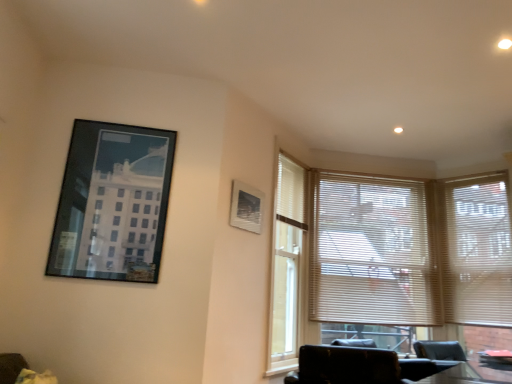
Question: Should I look upward or downward to see white blinds at right, the 1th window blind positioned from the right?

Choices:
 (A) up
 (B) down

Answer: (B)

Question: Can you confirm if matte black picture frame at upper left, which ranks as the 2th picture frame in back-to-front order, is thinner than black leather chair at lower right?

Choices:
 (A) yes
 (B) no

Answer: (A)

Question: Can you confirm if matte black picture frame at upper left, which ranks as the 2th picture frame in back-to-front order, is positioned to the left of black leather chair at lower right?

Choices:
 (A) no
 (B) yes

Answer: (B)

Question: Is black leather chair at lower right at the back of matte black picture frame at upper left, which appears as the second picture frame when viewed from the right?

Choices:
 (A) no
 (B) yes

Answer: (A)

Question: Can black leather chair at lower right be found inside matte black picture frame at upper left, the first picture frame from the left?

Choices:
 (A) no
 (B) yes

Answer: (A)

Question: Does matte black picture frame at upper left, the first picture frame from the left, lie in front of black leather chair at lower right?

Choices:
 (A) no
 (B) yes

Answer: (A)

Question: Considering the relative sizes of matte black picture frame at upper left, which ranks as the 2th picture frame in back-to-front order, and black leather chair at lower right in the image provided, is matte black picture frame at upper left, which ranks as the 2th picture frame in back-to-front order, wider than black leather chair at lower right?

Choices:
 (A) yes
 (B) no

Answer: (B)

Question: From the image's perspective, does white blinds at right, placed as the second window blind when sorted from left to right, appear higher than matte white picture frame at upper center, the first picture frame viewed from the right?

Choices:
 (A) no
 (B) yes

Answer: (A)

Question: Would you say white blinds at right, placed as the second window blind when sorted from left to right, contains matte white picture frame at upper center, which appears as the second picture frame when viewed from the left?

Choices:
 (A) yes
 (B) no

Answer: (B)

Question: Is white blinds at right, placed as the second window blind when sorted from left to right, completely or partially outside of matte white picture frame at upper center, the first picture frame viewed from the right?

Choices:
 (A) yes
 (B) no

Answer: (A)

Question: From the image's perspective, does white blinds at right, the 1th window blind positioned from the right, appear lower than matte white picture frame at upper center, the first picture frame viewed from the right?

Choices:
 (A) no
 (B) yes

Answer: (B)

Question: Considering the relative sizes of white blinds at right, placed as the second window blind when sorted from left to right, and matte white picture frame at upper center, the first picture frame viewed from the right, in the image provided, is white blinds at right, placed as the second window blind when sorted from left to right, wider than matte white picture frame at upper center, the first picture frame viewed from the right,?

Choices:
 (A) no
 (B) yes

Answer: (B)

Question: Considering the relative sizes of white blinds at right, placed as the second window blind when sorted from left to right, and matte white picture frame at upper center, positioned as the first picture frame in back-to-front order, in the image provided, is white blinds at right, placed as the second window blind when sorted from left to right, shorter than matte white picture frame at upper center, positioned as the first picture frame in back-to-front order,?

Choices:
 (A) yes
 (B) no

Answer: (B)

Question: Considering the relative positions of white blinds at right, the 1th window blind positioned from the right, and matte black picture frame at upper left, the first picture frame from the left, in the image provided, is white blinds at right, the 1th window blind positioned from the right, to the left of matte black picture frame at upper left, the first picture frame from the left, from the viewer's perspective?

Choices:
 (A) yes
 (B) no

Answer: (B)